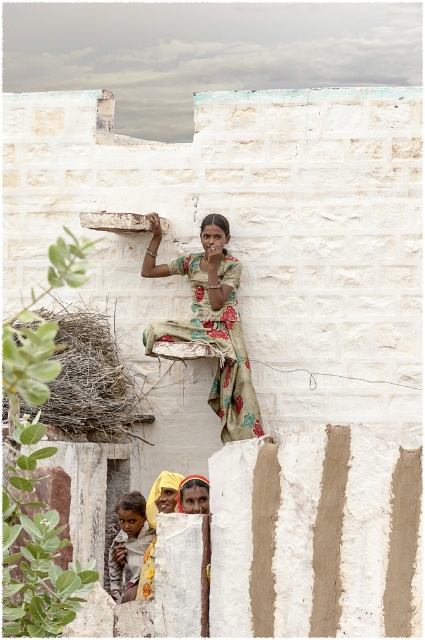
You are an interior designer assessing the space in the image. You notice the floral cotton dress at center and the brown textured cloth at lower left. Which object takes up more area in the scene?

The brown textured cloth at lower left takes up more area in the scene because the floral cotton dress at center occupies less space than brown textured cloth at lower left.